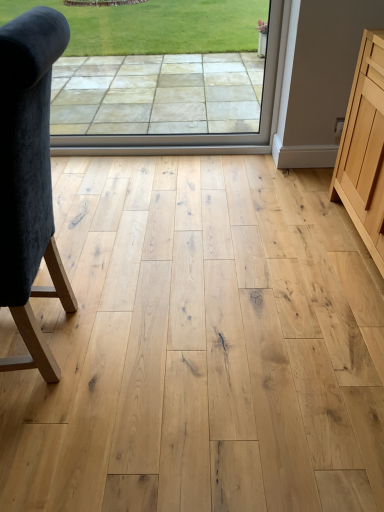
Question: Is point (18, 24) closer or farther from the camera than point (16, 280)?

Choices:
 (A) farther
 (B) closer

Answer: (B)

Question: Looking at the image, does transparent glass window at center seem bigger or smaller compared to velvet dark blue chair at left?

Choices:
 (A) big
 (B) small

Answer: (B)

Question: Considering the real-world distances, which object is closest to the velvet dark blue chair at left?

Choices:
 (A) natural wood cabinet at right
 (B) transparent glass window at center

Answer: (A)

Question: Which is farther from the natural wood cabinet at right?

Choices:
 (A) velvet dark blue chair at left
 (B) transparent glass window at center

Answer: (A)